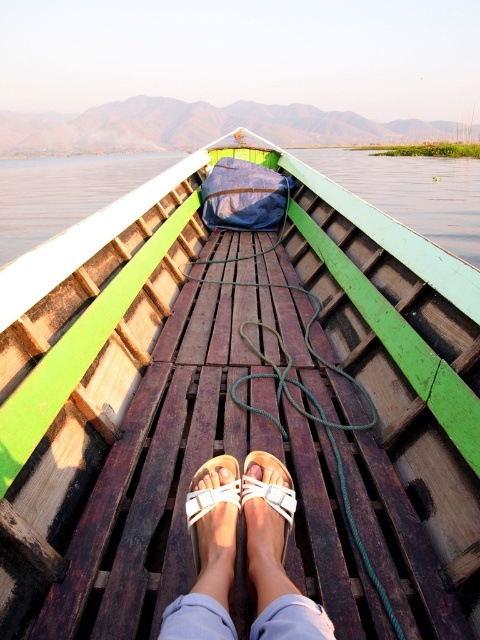
Which is more to the left, transparent water at center or white leather sandals at center?

transparent water at center is more to the left.

Can you confirm if transparent water at center is taller than white leather sandals at center?

Correct, transparent water at center is much taller as white leather sandals at center.

Who is more distant from viewer, (x=122, y=170) or (x=227, y=536)?

Positioned behind is point (x=122, y=170).

This screenshot has width=480, height=640. What are the coordinates of `transparent water at center` in the screenshot? It's located at (412, 193).

The height and width of the screenshot is (640, 480). What do you see at coordinates (247, 554) in the screenshot? I see `white leather sandals at center` at bounding box center [247, 554].

From the picture: Is white leather sandals at center bigger than white matte sandal at center?

Yes, white leather sandals at center is bigger than white matte sandal at center.

Where is `white leather sandals at center`? white leather sandals at center is located at coordinates (247, 554).

What do you see at coordinates (412, 193) in the screenshot? Image resolution: width=480 pixels, height=640 pixels. I see `transparent water at center` at bounding box center [412, 193].

Find the location of `transparent water at center`. transparent water at center is located at coordinates (412, 193).